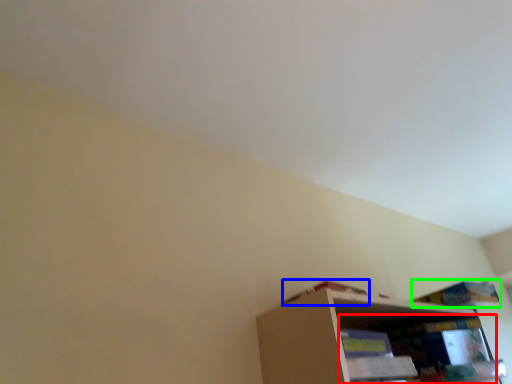
Question: Considering the real-world distances, which object is farthest from shelf (highlighted by a red box)? book (highlighted by a blue box) or book (highlighted by a green box)?

Choices:
 (A) book
 (B) book

Answer: (A)